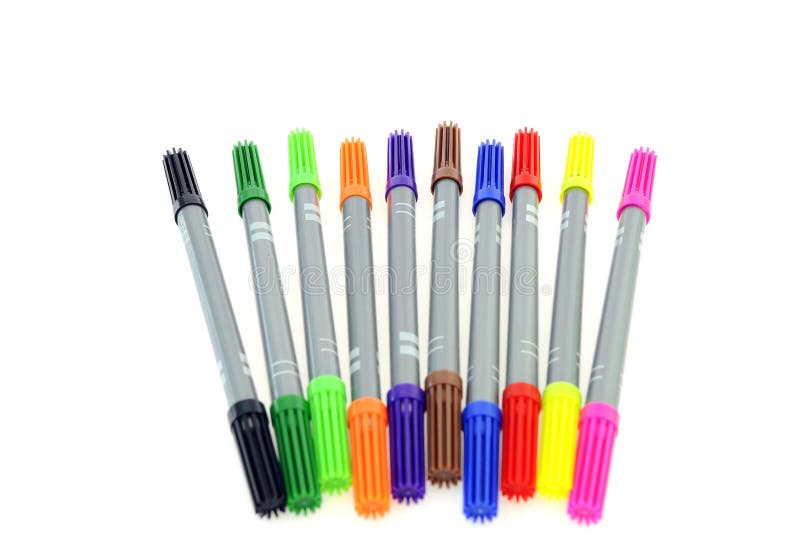
Image resolution: width=800 pixels, height=533 pixels. I want to click on green or blue markers, so click(296, 456), click(333, 445), click(406, 453), click(490, 488).